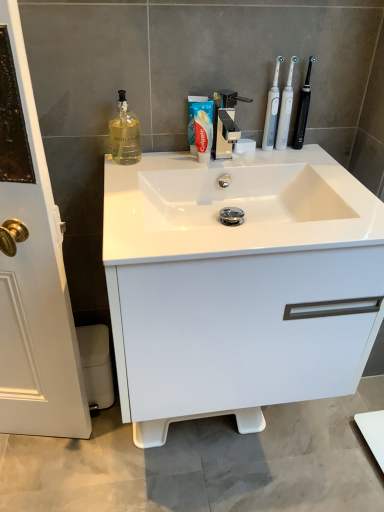
Find the location of `empty space that is in between white matte toothpaste at center and translucent glass bottle at upper left`. empty space that is in between white matte toothpaste at center and translucent glass bottle at upper left is located at coordinates (161, 159).